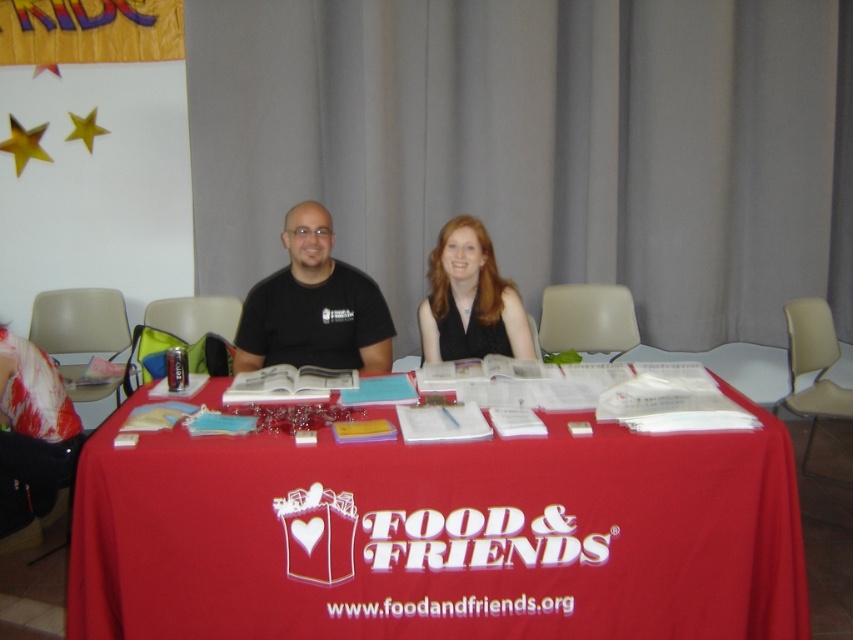
Does point (294, 209) come closer to viewer compared to point (479, 257)?

No.

Can you confirm if black matte t-shirt at center is positioned to the right of matte black vest at center?

In fact, black matte t-shirt at center is to the left of matte black vest at center.

Is point (296, 282) less distant than point (494, 298)?

That is False.

The height and width of the screenshot is (640, 853). I want to click on black matte t-shirt at center, so click(312, 307).

Between red cloth table at center and black matte t-shirt at center, which one appears on the left side from the viewer's perspective?

black matte t-shirt at center is more to the left.

At what (x,y) coordinates should I click in order to perform the action: click on red cloth table at center. Please return your answer as a coordinate pair (x, y). Looking at the image, I should click on (439, 536).

Can you confirm if red cloth table at center is positioned to the left of matte black vest at center?

Yes, red cloth table at center is to the left of matte black vest at center.

Does red cloth table at center have a lesser width compared to matte black vest at center?

No, red cloth table at center is not thinner than matte black vest at center.

Who is more distant from viewer, (607, 488) or (440, 237)?

The point (440, 237) is more distant.

Identify the location of red cloth table at center. Image resolution: width=853 pixels, height=640 pixels. (439, 536).